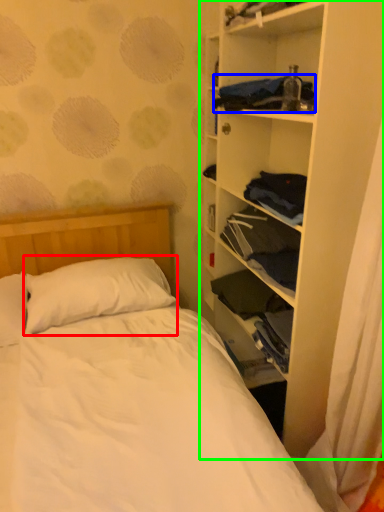
Question: Which is farther away from pillow (highlighted by a red box)? clothing (highlighted by a blue box) or shelf (highlighted by a green box)?

Choices:
 (A) clothing
 (B) shelf

Answer: (A)